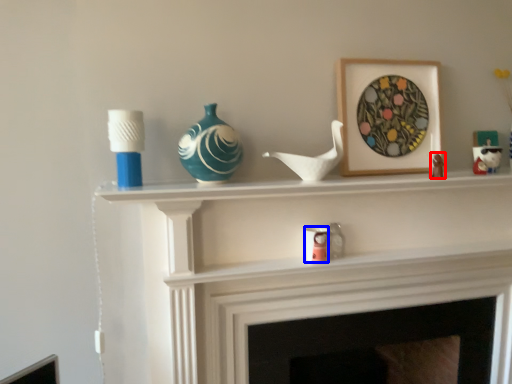
Question: Among these objects, which one is nearest to the camera, toy (highlighted by a red box) or candle holder (highlighted by a blue box)?

Choices:
 (A) toy
 (B) candle holder

Answer: (A)